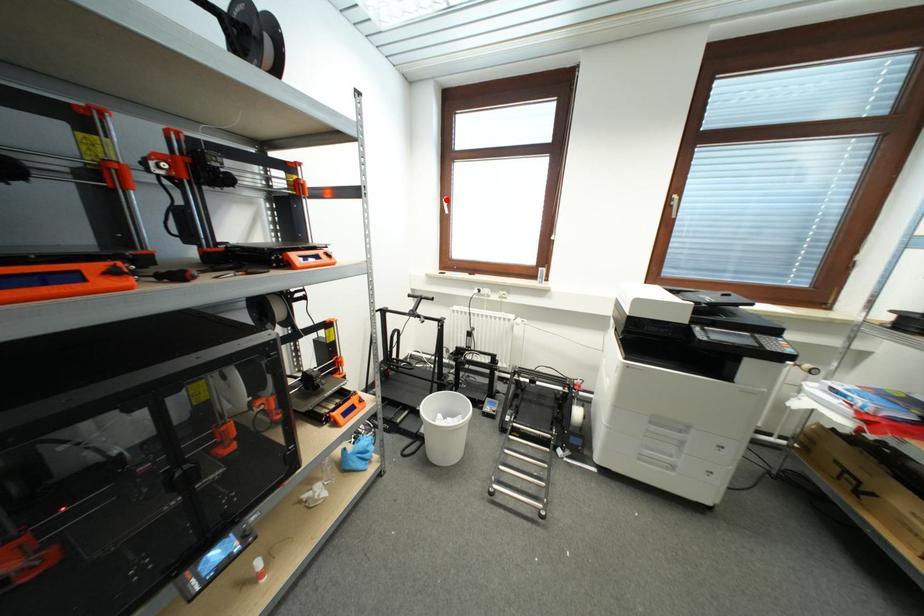
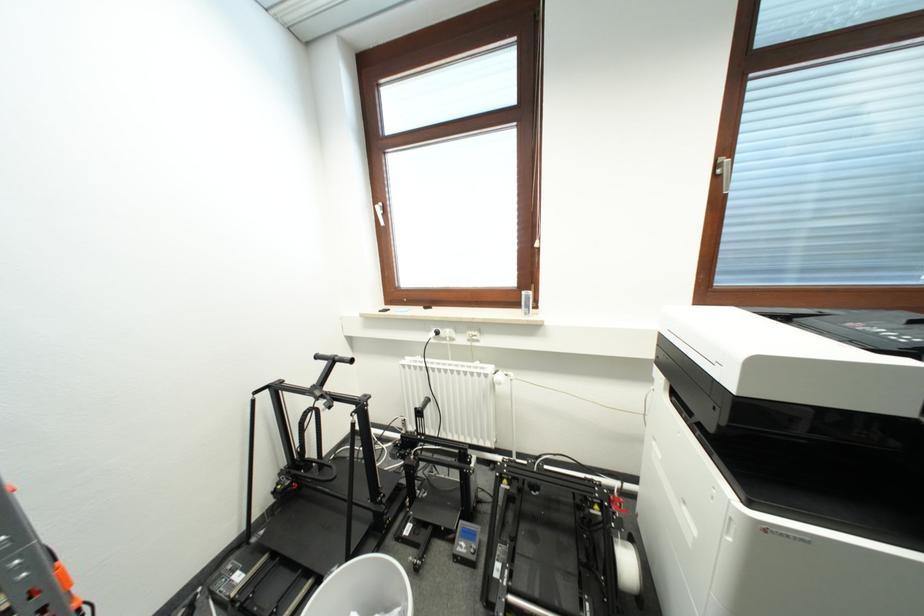
In the second image, find the point that corresponds to the highlighted location in the first image.

(379, 206)